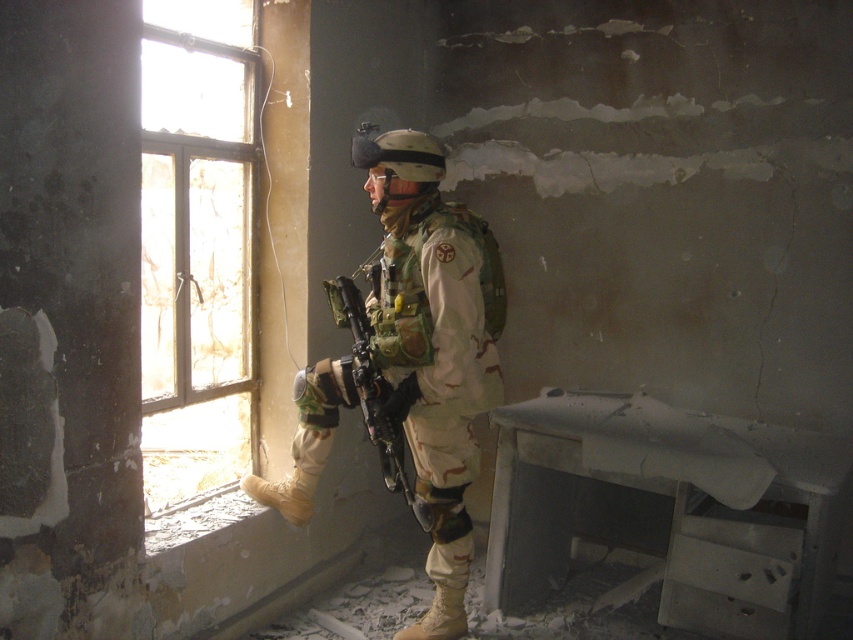
You are a soldier in a damaged building. You need to check the outside area for safety before exiting. Since the clear glass window at left is taller than the camouflage uniform at center, which object allows you to see outside without exposing yourself fully?

The clear glass window at left is taller than the camouflage uniform at center, so you can use the clear glass window at left to observe the outside area safely without fully exposing yourself.

You are a photographer trying to capture the soldier in the damaged building. Since the clear glass window at left and the camouflage uniform at center are in your view, which object would block more of the sunlight coming into the frame?

The clear glass window at left allows sunlight to pass through, so it does not block sunlight. The camouflage uniform at center is opaque and would block more sunlight in the frame.

You are a soldier in a damaged building and need to exit through the clear glass window at left. Your camouflage uniform at center is currently blocking your path. Can you squeeze through the window without removing the uniform?

The clear glass window at left is narrower than the camouflage uniform at center, so you cannot squeeze through the window without removing the uniform.